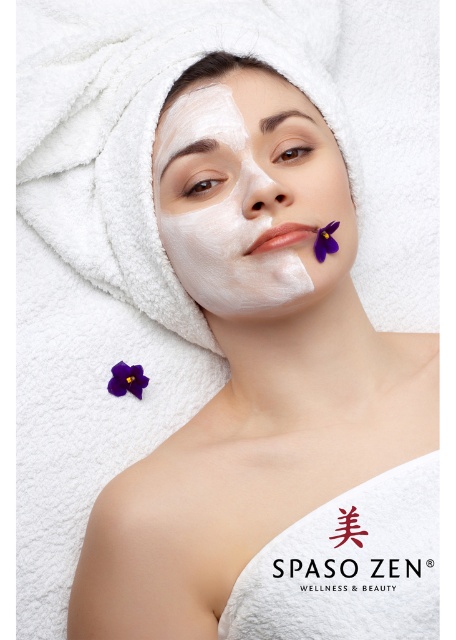
You are a photographer setting up a shoot for a beauty product advertisement. You need to ensure that the white matte facial mask at center and the purple matte flower at upper right are positioned correctly according to the scene. Based on the image description, which object is located to the left of the other?

The white matte facial mask at center is to the left of the purple matte flower at upper right.

You are a beauty consultant trying to place a new decorative sticker between the white matte facial mask at center and the purple matte flower at upper center. The sticker is 12 inches long. Will it fit between them?

The distance between the white matte facial mask at center and the purple matte flower at upper center is 10.41 inches. Since the sticker is 12 inches long, it is longer than the available space, so it will not fit between them.

You are an artist trying to recreate this image. The purple matte flower at upper center is crucial for the composition. Where exactly should you place it on a coordinate system from 0 to 1 in both x and y axes? Please provide the coordinates as a point in parentheses.

The purple matte flower at upper center should be placed at point (127, 380).